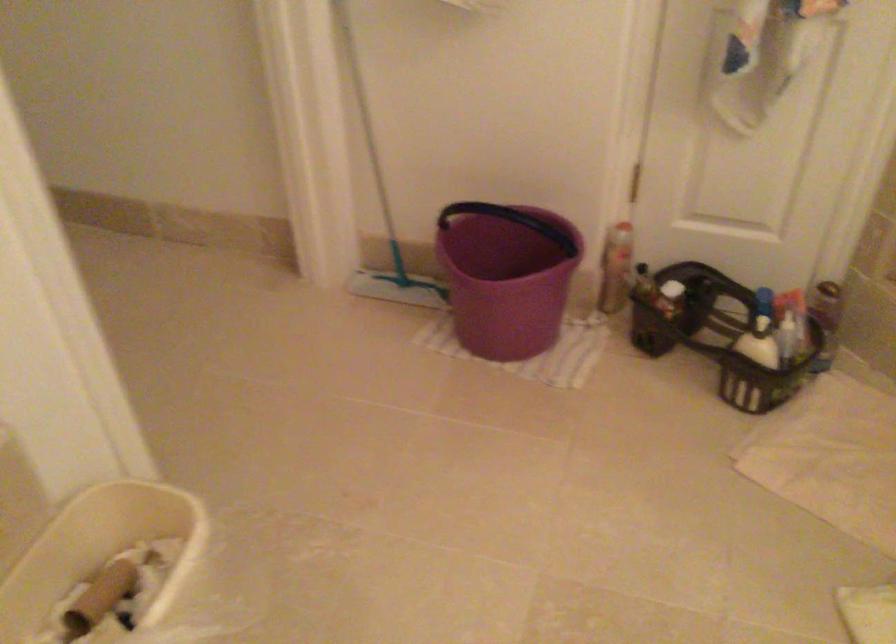
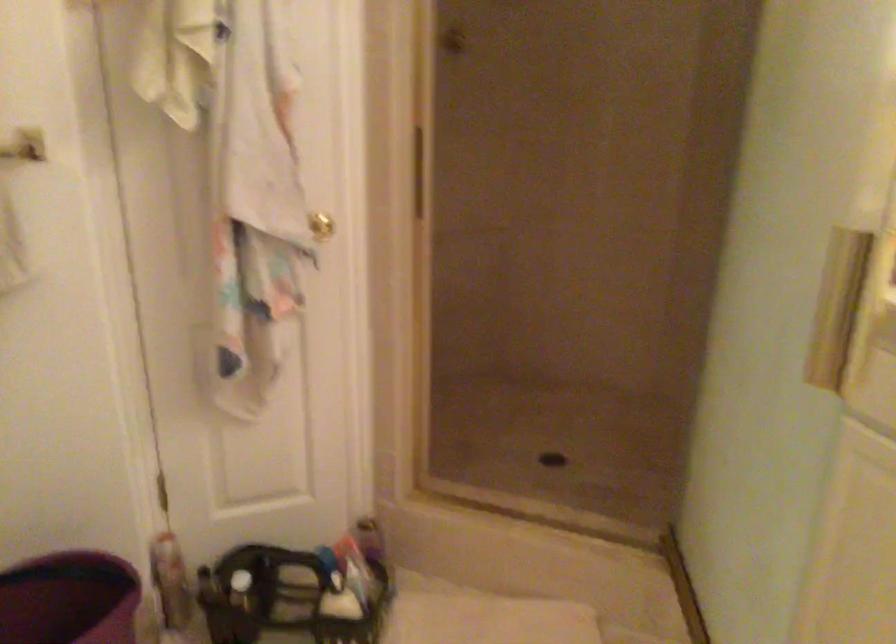
Find the pixel in the second image that matches [621,232] in the first image.

(165, 545)